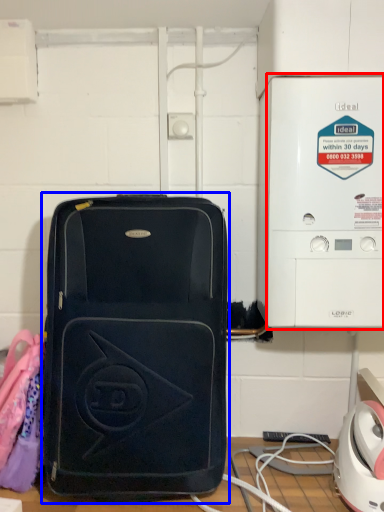
Question: Which object is closer to the camera taking this photo, appliance (highlighted by a red box) or luggage and bags (highlighted by a blue box)?

Choices:
 (A) appliance
 (B) luggage and bags

Answer: (B)